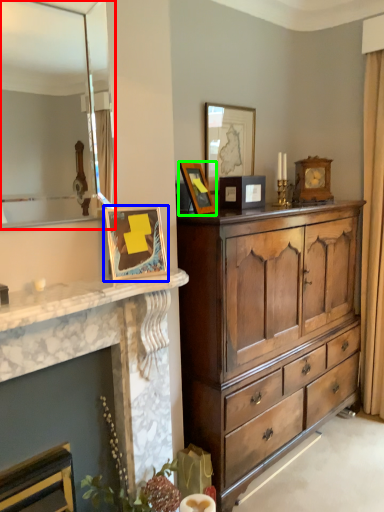
Question: Based on their relative distances, which object is nearer to mirror (highlighted by a red box)? Choose from picture frame (highlighted by a blue box) and picture frame (highlighted by a green box).

Choices:
 (A) picture frame
 (B) picture frame

Answer: (A)